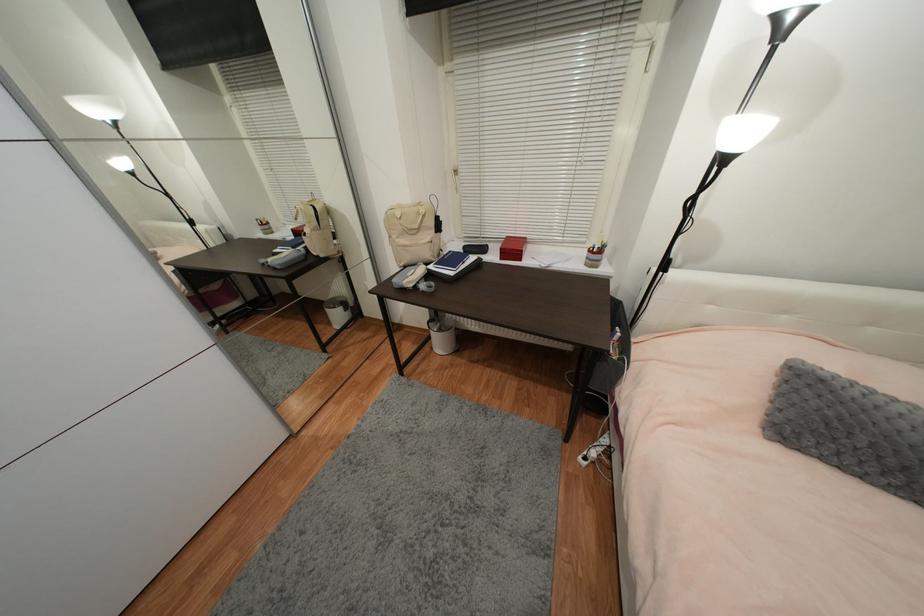
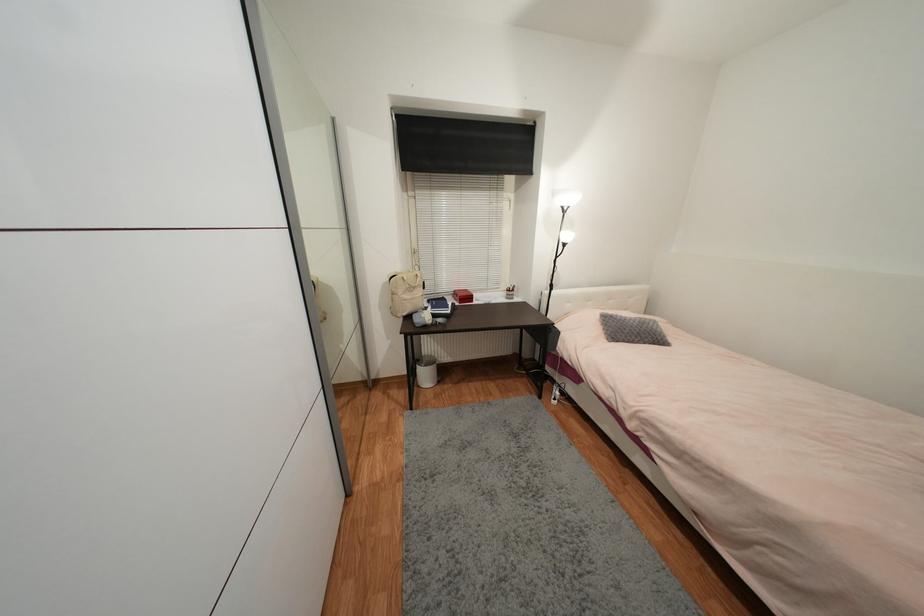
Locate, in the second image, the point that corresponds to [423,205] in the first image.

(412, 273)